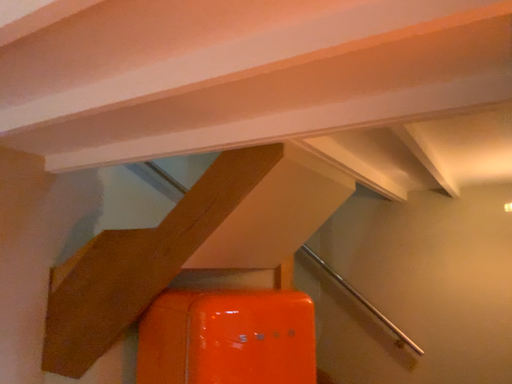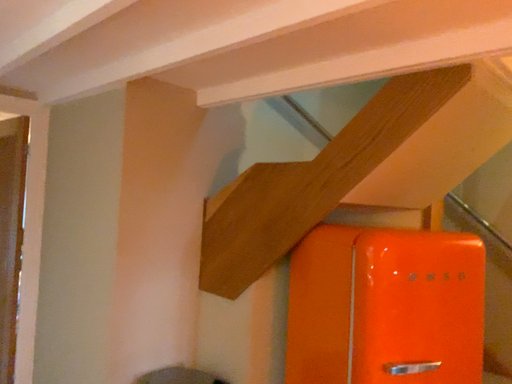
Question: Which way did the camera rotate in the video?

Choices:
 (A) rotated upward
 (B) rotated downward

Answer: (B)